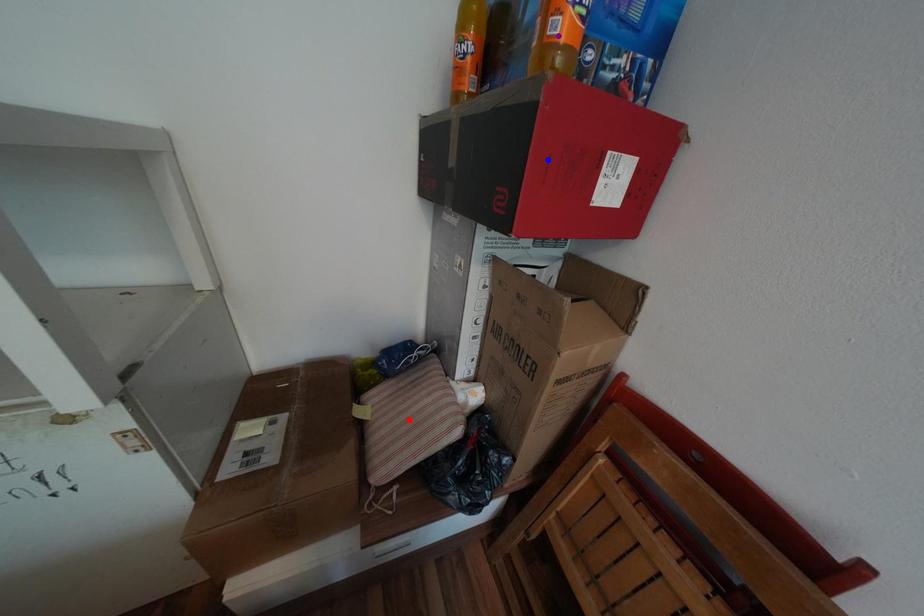
Order these from nearest to farthest:
blue point, red point, purple point

1. purple point
2. blue point
3. red point